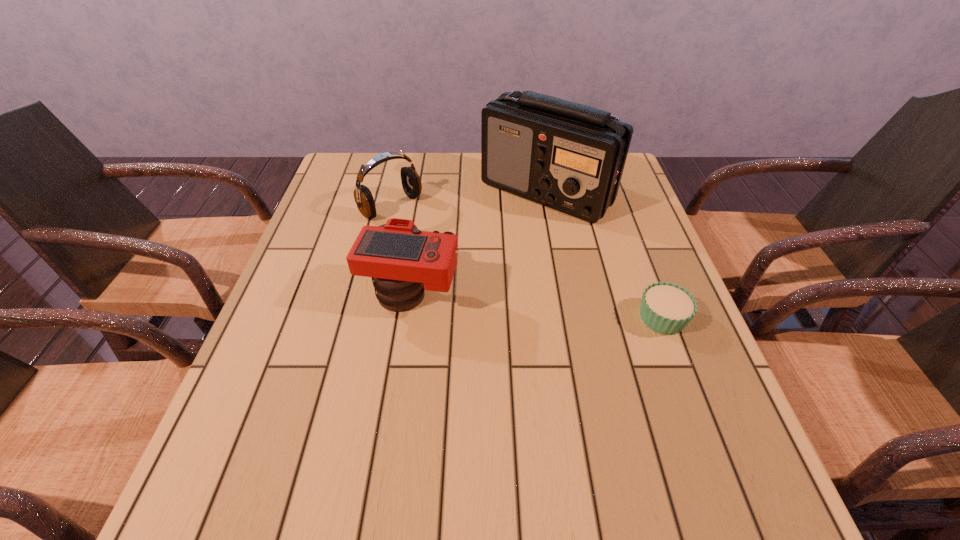
Identify the location of vacant space at the near edge of the desktop. The width and height of the screenshot is (960, 540). (521, 424).

I want to click on free space at the left edge of the desktop, so click(x=311, y=246).

You are a GUI agent. You are given a task and a screenshot of the screen. Output one action in this format:
    pyautogui.click(x=<x>, y=<y>)
    Task: Click on the blank space at the right edge of the desktop
    The height and width of the screenshot is (540, 960).
    Given the screenshot: What is the action you would take?
    pyautogui.click(x=630, y=267)

This screenshot has height=540, width=960. I want to click on free space between the cupcake and the camera, so click(538, 306).

Where is `vacant space in between the camera and the cupcake`? This screenshot has height=540, width=960. vacant space in between the camera and the cupcake is located at coordinates (538, 306).

Locate an element on the screen. free space between the shortest object and the tallest object is located at coordinates (605, 255).

Where is `blank region between the headset and the cupcake`? blank region between the headset and the cupcake is located at coordinates (527, 262).

You are a GUI agent. You are given a task and a screenshot of the screen. Output one action in this format:
    pyautogui.click(x=<x>, y=<y>)
    Task: Click on the vacant space that's between the camera and the radio receiver
    
    Given the screenshot: What is the action you would take?
    pyautogui.click(x=480, y=243)

Where is `vacant area that lies between the headset and the shortest object`? The width and height of the screenshot is (960, 540). vacant area that lies between the headset and the shortest object is located at coordinates tap(527, 262).

Locate an element on the screen. empty space between the cupcake and the tallest object is located at coordinates (605, 255).